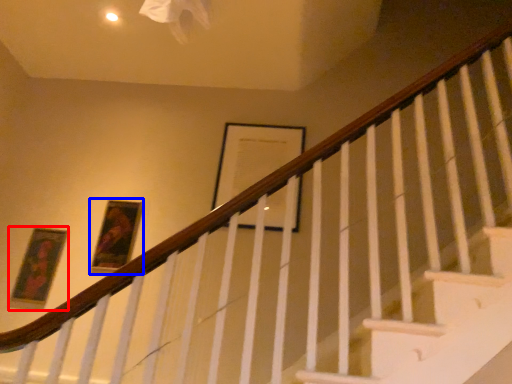
Question: Which object is closer to the camera taking this photo, picture frame (highlighted by a red box) or picture frame (highlighted by a blue box)?

Choices:
 (A) picture frame
 (B) picture frame

Answer: (A)